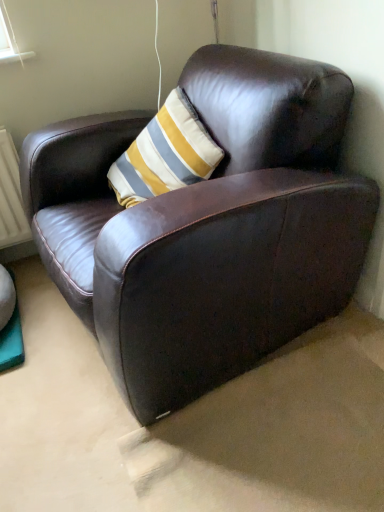
Where is `shiny brown leather armchair at center`? The height and width of the screenshot is (512, 384). shiny brown leather armchair at center is located at coordinates (206, 227).

This screenshot has height=512, width=384. What do you see at coordinates (206, 227) in the screenshot? I see `shiny brown leather armchair at center` at bounding box center [206, 227].

You are a GUI agent. You are given a task and a screenshot of the screen. Output one action in this format:
    pyautogui.click(x=<x>, y=<y>)
    Task: Click on the shiny brown leather armchair at center
    Image resolution: width=384 pixels, height=512 pixels.
    Given the screenshot: What is the action you would take?
    pyautogui.click(x=206, y=227)